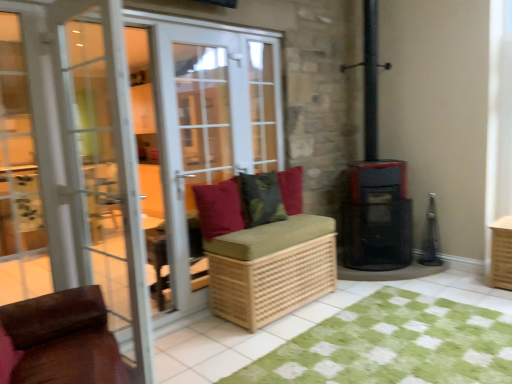
I want to click on free space to the left of wooden crate at right, so pos(468,281).